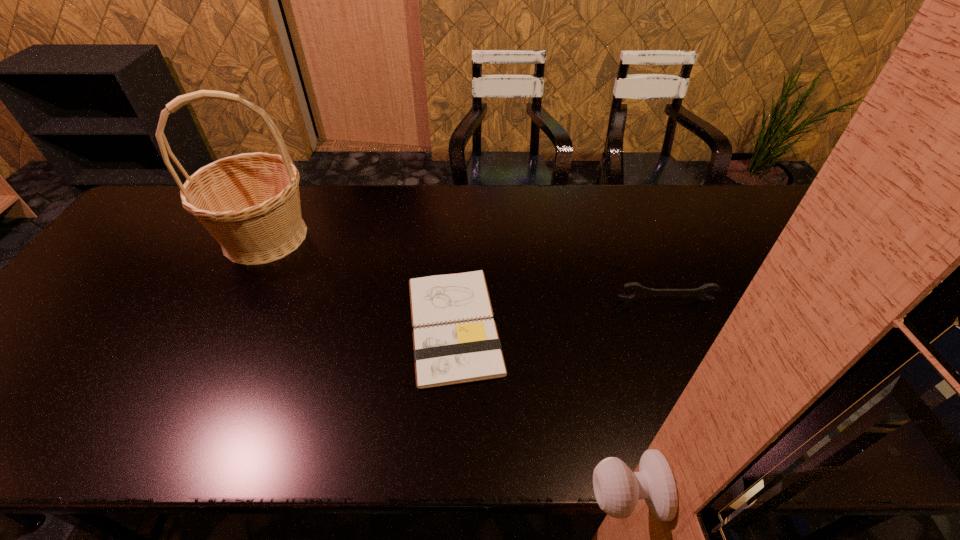
At what (x,y) coordinates should I click in order to perform the action: click on the closest object to the shortest object. Please return your answer as a coordinate pair (x, y). Looking at the image, I should click on (641, 292).